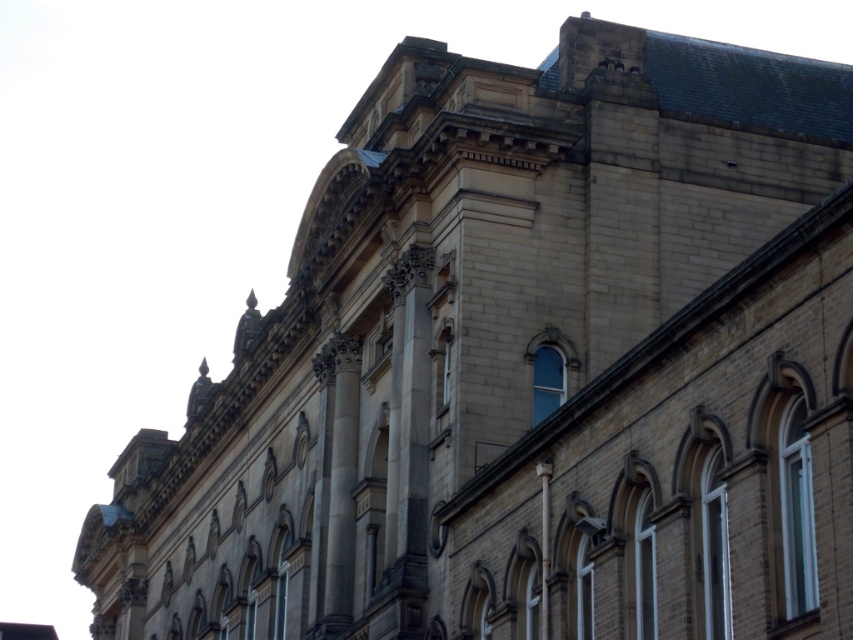
You are standing in front of the historic building and notice two points marked on its facade. The first point is at coordinates point (802, 520) and the second is at point (447, 349). Which of these two points is closer to you?

Point (802, 520) is in front of point (447, 349), so it is closer to you.

You are an architect inspecting the building facade. You notice the white plastic window at right and the clear glass window at center. Which window is positioned lower on the building?

The white plastic window at right is positioned lower on the building because it is below the clear glass window at center.